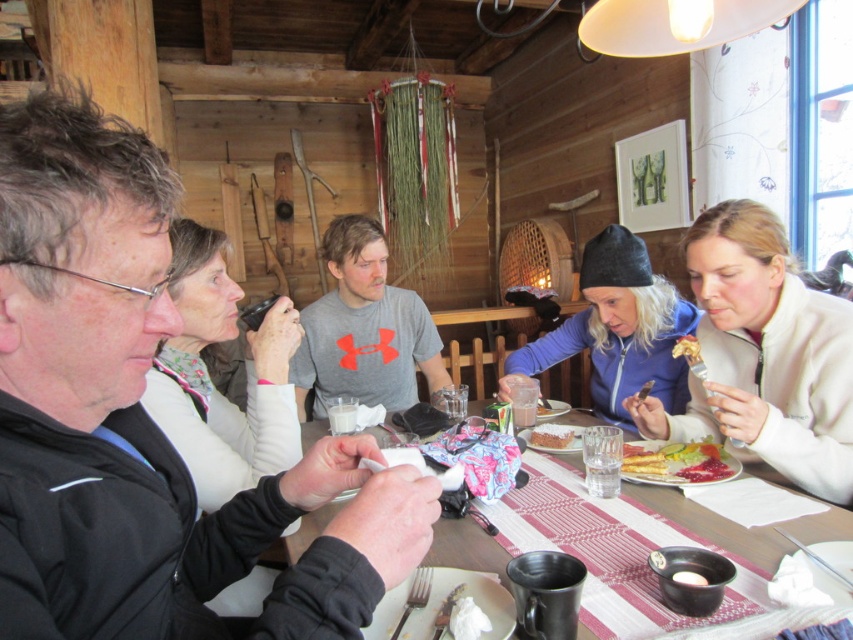
You are a guest at this rustic cabin dining table. You notice the smooth white plate at center and the golden crispy pastry at center. Which object is taller when viewed from above?

The golden crispy pastry at center is taller than the smooth white plate at center.

You are a server at the rustic cabin lodge. You need to place a new dessert plate between the smooth white plate at center and the golden crispy pastry at center. Which object should you place it closer to if the dessert plate is wider than both?

The dessert plate should be placed closer to the smooth white plate at center because it might be wider than the golden crispy pastry at center, so aligning with the wider object would maintain spacing consistency.